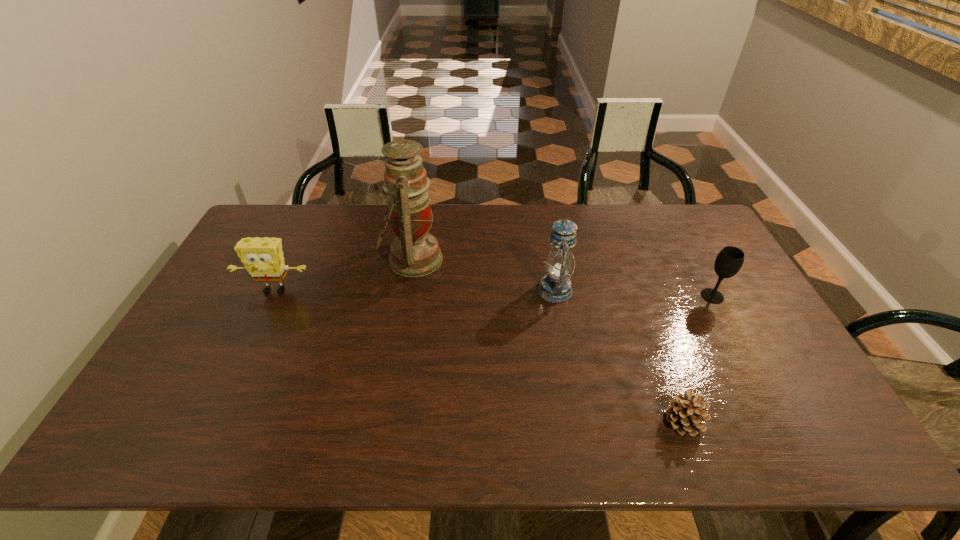
I want to click on the fourth object from right to left, so click(414, 252).

At what (x,y) coordinates should I click in order to perform the action: click on the tallest object. Please return your answer as a coordinate pair (x, y). Looking at the image, I should click on (414, 252).

The image size is (960, 540). Identify the location of the third object from right to left. (555, 286).

Where is `lantern`? The height and width of the screenshot is (540, 960). lantern is located at coordinates (555, 286).

Where is `the leftmost object`? The image size is (960, 540). the leftmost object is located at coordinates (263, 258).

This screenshot has width=960, height=540. Identify the location of the rightmost object. (729, 261).

Image resolution: width=960 pixels, height=540 pixels. What are the coordinates of `pinecone` in the screenshot? It's located at (686, 414).

This screenshot has width=960, height=540. I want to click on the fourth object from left to right, so click(686, 414).

The image size is (960, 540). I want to click on vacant area situated on the front of the fourth object from right to left, so click(399, 336).

Find the location of a particular element. The image size is (960, 540). vacant space located 0.260m on the front-facing side of the fourth shortest object is located at coordinates (452, 290).